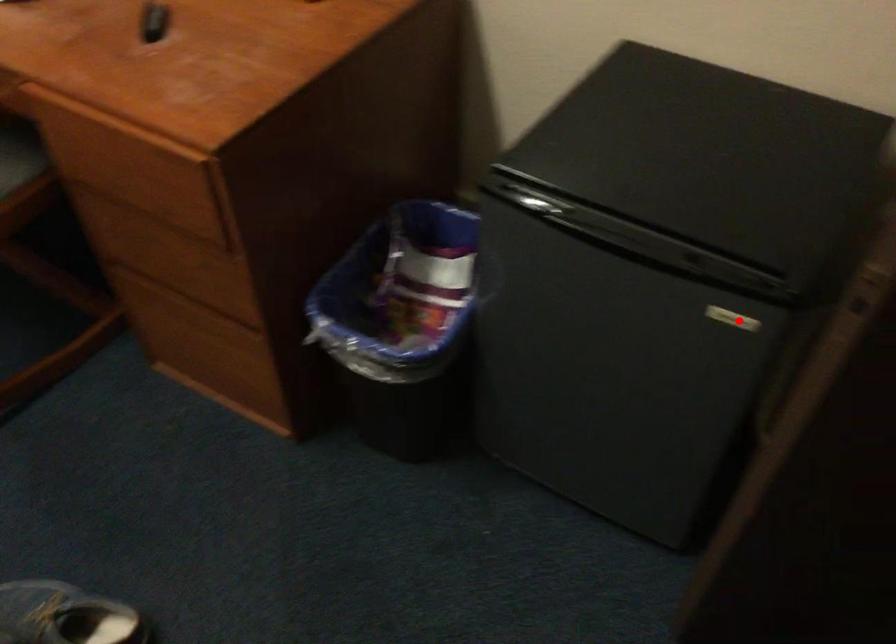
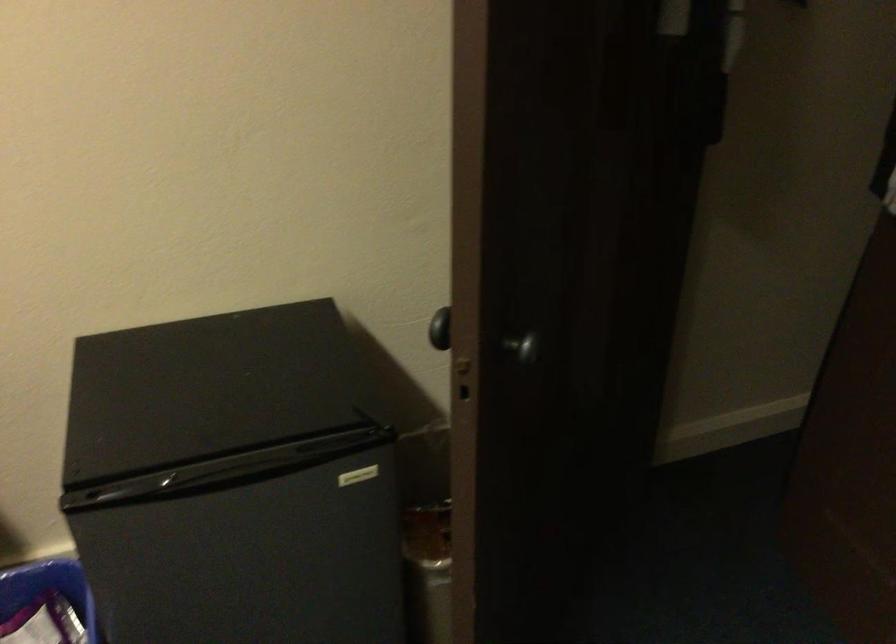
Where in the second image is the point corresponding to the highlighted location from the first image?

(358, 476)